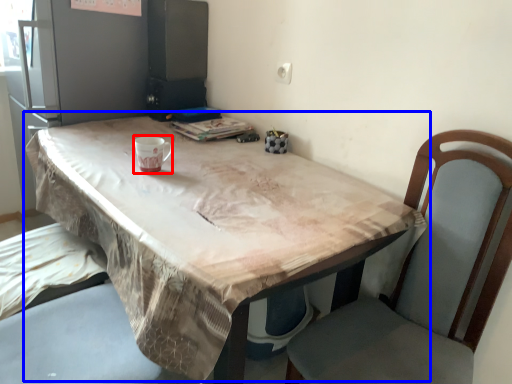
Question: Which object appears farthest to the camera in this image, mug (highlighted by a red box) or table (highlighted by a blue box)?

Choices:
 (A) mug
 (B) table

Answer: (A)